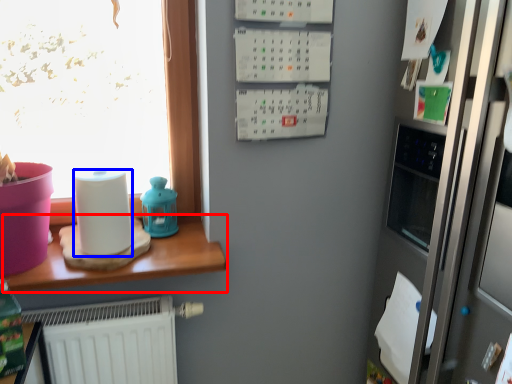
Question: Which object appears farthest to the camera in this image, table (highlighted by a red box) or paper towel (highlighted by a blue box)?

Choices:
 (A) table
 (B) paper towel

Answer: (B)